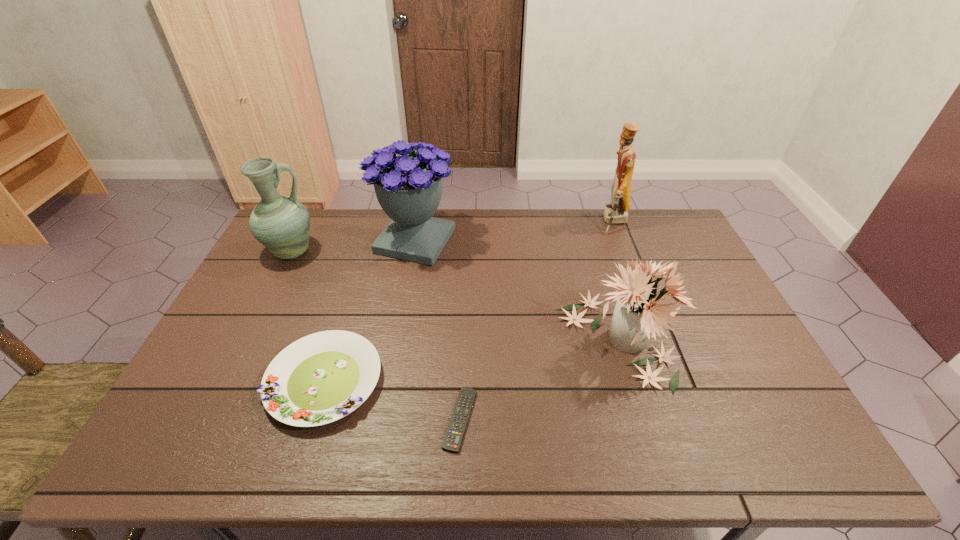
Where is `remote control that is positioned at the near edge`? remote control that is positioned at the near edge is located at coordinates (452, 442).

Where is `object present at the left edge`? The height and width of the screenshot is (540, 960). object present at the left edge is located at coordinates (281, 223).

The image size is (960, 540). Find the location of `object located in the far left corner section of the desktop`. object located in the far left corner section of the desktop is located at coordinates (281, 223).

In the image, there is a desktop. Where is `vacant space at the far edge`? Image resolution: width=960 pixels, height=540 pixels. vacant space at the far edge is located at coordinates (482, 235).

Locate an element on the screen. The height and width of the screenshot is (540, 960). free location at the near edge of the desktop is located at coordinates (698, 431).

I want to click on vacant space at the left edge of the desktop, so click(263, 284).

Identify the location of blank area at the right edge. The height and width of the screenshot is (540, 960). (693, 281).

Find the location of `blank area at the near left corner`. blank area at the near left corner is located at coordinates (185, 446).

Identify the location of vacant space at the far right corner of the desktop. The height and width of the screenshot is (540, 960). (660, 224).

The width and height of the screenshot is (960, 540). Identify the location of vacant point located between the leftmost object and the second shortest object. (308, 316).